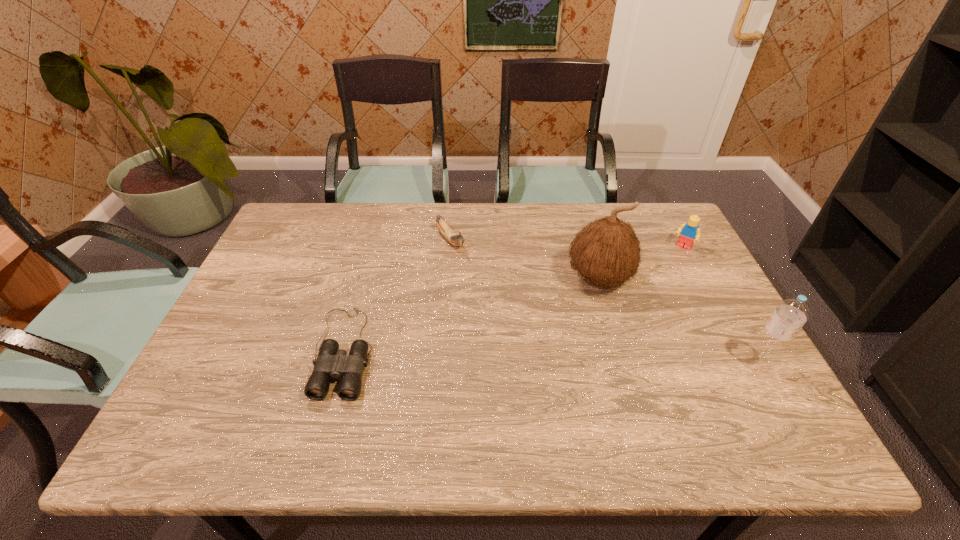
Where is `free spot between the coconut and the water bottle`? free spot between the coconut and the water bottle is located at coordinates (679, 321).

Where is `empty space between the tallest object and the fourth shortest object`? The width and height of the screenshot is (960, 540). empty space between the tallest object and the fourth shortest object is located at coordinates (679, 321).

In order to click on empty space between the coconut and the fourth shortest object in this screenshot , I will do `click(679, 321)`.

Find the location of a particular element. vacant area that lies between the fourth tallest object and the Lego is located at coordinates (566, 244).

Where is `vacant point located between the coconut and the water bottle`? Image resolution: width=960 pixels, height=540 pixels. vacant point located between the coconut and the water bottle is located at coordinates click(679, 321).

At what (x,y) coordinates should I click in order to perform the action: click on vacant space in between the binoculars and the tallest object. Please return your answer as a coordinate pair (x, y). The image size is (960, 540). Looking at the image, I should click on (472, 315).

Find the location of a particular element. The width and height of the screenshot is (960, 540). vacant area between the fourth shortest object and the binoculars is located at coordinates (551, 357).

In order to click on vacant area that lies between the fourth tallest object and the third object from left to right in this screenshot , I will do `click(525, 260)`.

This screenshot has width=960, height=540. Identify the location of free area in between the shortest object and the fourth tallest object. (397, 296).

The width and height of the screenshot is (960, 540). Identify the location of the third closest object to the third nearest object. (457, 240).